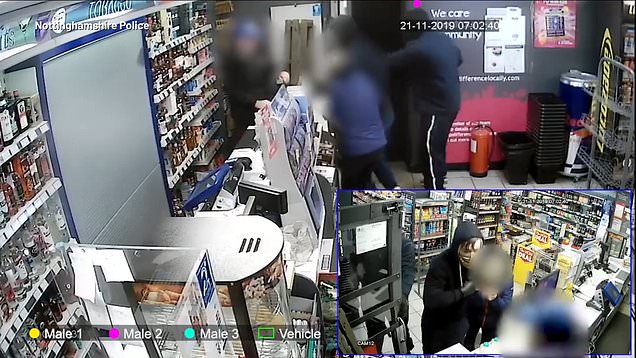
Identify the location of background liquor bottles. This screenshot has height=358, width=636. (534, 208).